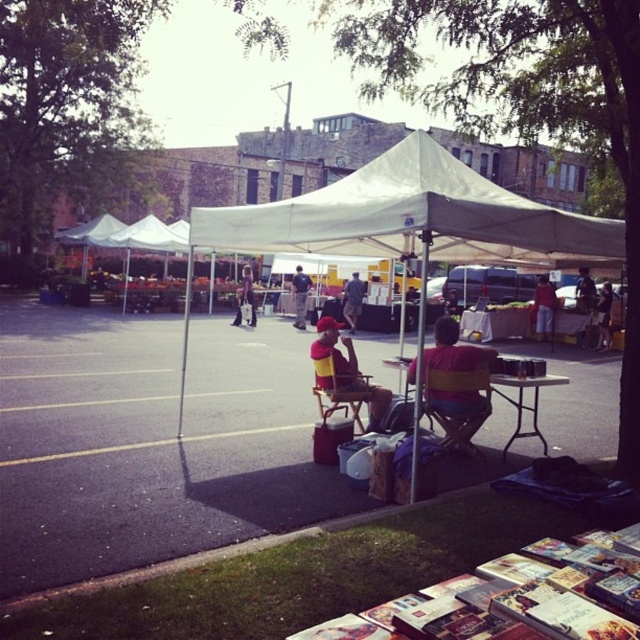
Does white fabric tent at center have a larger size compared to camouflage fabric jacket at center?

Yes.

Is white fabric tent at center wider than camouflage fabric jacket at center?

Indeed, white fabric tent at center has a greater width compared to camouflage fabric jacket at center.

Between point (417, 168) and point (356, 285), which one is positioned behind?

Point (356, 285)

Identify the location of white fabric tent at center. [406, 221].

From the picture: Is wooden table at center shorter than yellow fabric chair at center?

Incorrect, wooden table at center's height does not fall short of yellow fabric chair at center's.

Does wooden table at center appear on the right side of yellow fabric chair at center?

In fact, wooden table at center is to the left of yellow fabric chair at center.

Find the location of `wooden table at center`. wooden table at center is located at coordinates (522, 401).

Where is `wooden table at center`? The image size is (640, 640). wooden table at center is located at coordinates (522, 401).

Does white fabric tent at center appear on the right side of wooden folding chair at center?

In fact, white fabric tent at center is to the left of wooden folding chair at center.

Does white fabric tent at center appear on the left side of wooden folding chair at center?

Yes, white fabric tent at center is to the left of wooden folding chair at center.

Where is `white fabric tent at center`? white fabric tent at center is located at coordinates (406, 221).

Identify the location of white fabric tent at center. This screenshot has width=640, height=640. (406, 221).